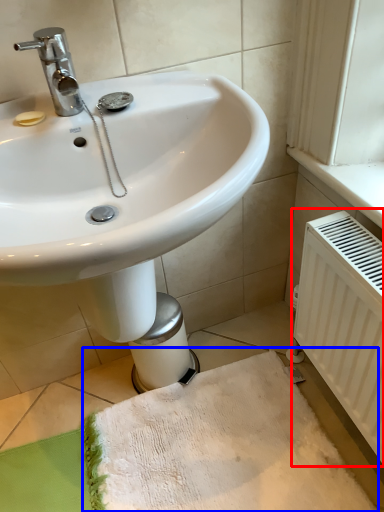
Question: Which of the following is the farthest to the observer, radiator (highlighted by a red box) or bath towel (highlighted by a blue box)?

Choices:
 (A) radiator
 (B) bath towel

Answer: (B)